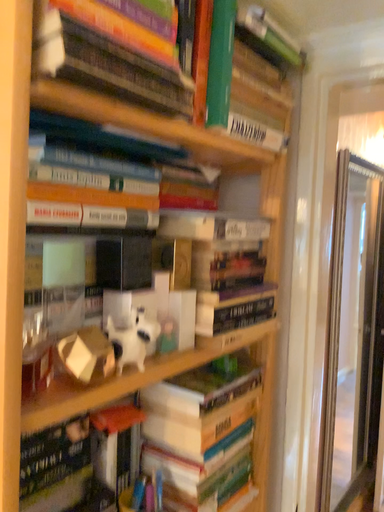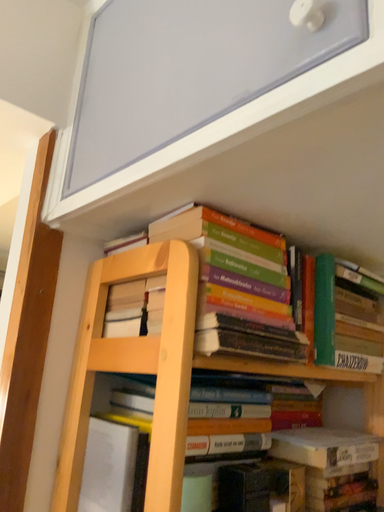
Question: Which way did the camera rotate in the video?

Choices:
 (A) rotated upward
 (B) rotated downward

Answer: (A)